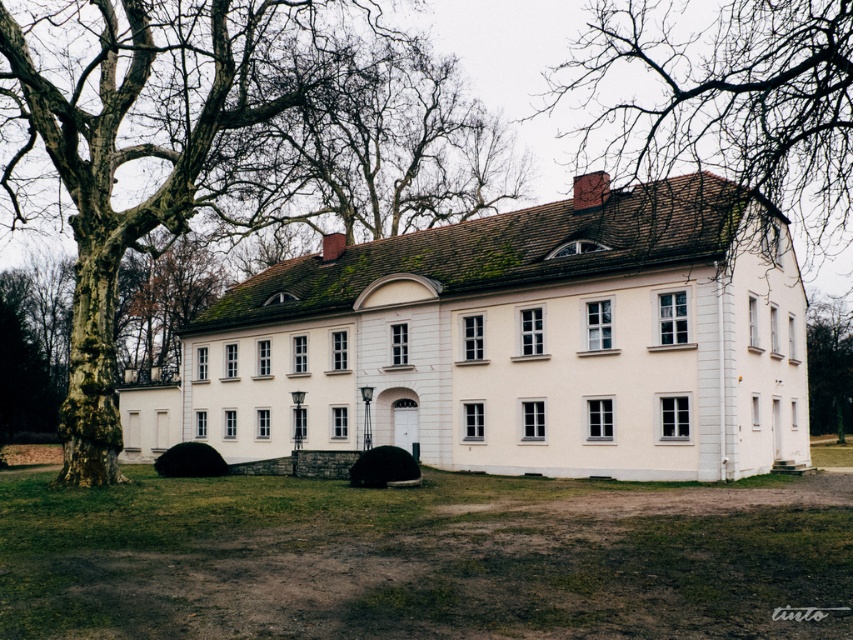
Based on the scene described, which object, the bare branches at upper center or the green leafy tree at right, occupies a larger area in the image?

The bare branches at upper center is bigger than the green leafy tree at right, so it occupies a larger area in the image.

You are standing in front of the building and want to know which object is closer to the entrance. The entrance is marked by a white door framed by a small archway. Which one is closer to the entrance between the smooth bark tree at left and the bare branches at upper center?

The smooth bark tree at left is closer to the entrance because it is positioned at the left near the entrance, while the bare branches at upper center are located higher up and further away from the entrance area.

You are standing in front of the building and want to determine which tree is taller between the smooth bark tree at left and the green leafy tree at right. Based on the scene, which one is taller?

The smooth bark tree at left is taller than the green leafy tree at right.